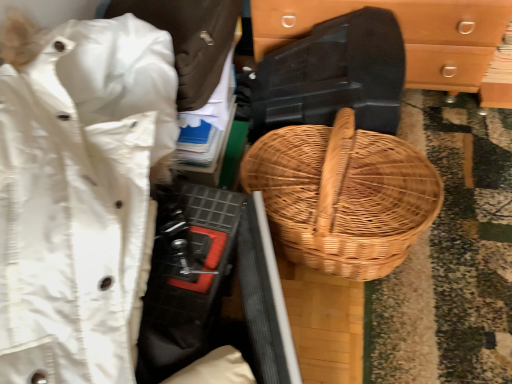
You are a GUI agent. You are given a task and a screenshot of the screen. Output one action in this format:
    pyautogui.click(x=<x>, y=<y>)
    Task: Click on the free spot to the right of brown wicker picnic basket at center
    Image resolution: width=512 pixels, height=384 pixels.
    Given the screenshot: What is the action you would take?
    pyautogui.click(x=463, y=232)